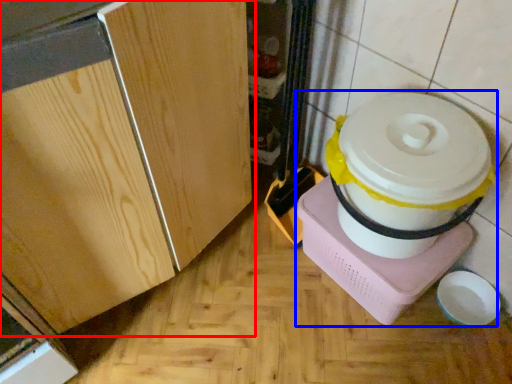
Question: Among these objects, which one is nearest to the camera, cabinetry (highlighted by a red box) or appliance (highlighted by a blue box)?

Choices:
 (A) cabinetry
 (B) appliance

Answer: (A)